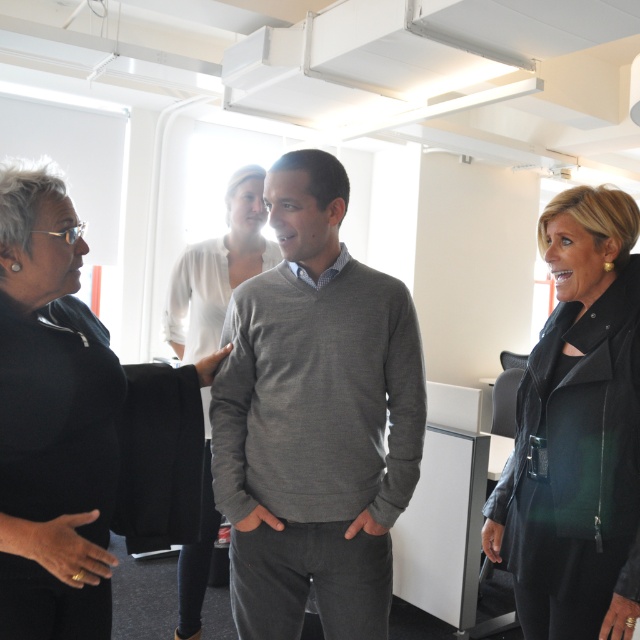
In the scene shown: Is black leather jacket at right below black leather jacket at left?

Yes, black leather jacket at right is below black leather jacket at left.

Who is more forward, (600, 612) or (52, 278)?

Point (52, 278)

Locate an element on the screen. black leather jacket at right is located at coordinates (577, 433).

Which is behind, point (324, 173) or point (554, 208)?

Positioned behind is point (554, 208).

Describe the element at coordinates (316, 419) in the screenshot. I see `gray sweater at center` at that location.

At what (x,y) coordinates should I click in order to perform the action: click on gray sweater at center. Please return your answer as a coordinate pair (x, y). Image resolution: width=640 pixels, height=640 pixels. Looking at the image, I should click on (316, 419).

Which is below, gray sweater at center or black leather jacket at left?

black leather jacket at left is lower down.

Is gray sweater at center further to the viewer compared to black leather jacket at left?

Yes, it is behind black leather jacket at left.

The image size is (640, 640). Describe the element at coordinates (316, 419) in the screenshot. I see `gray sweater at center` at that location.

Find the location of a particular element. This screenshot has height=640, width=640. gray sweater at center is located at coordinates (316, 419).